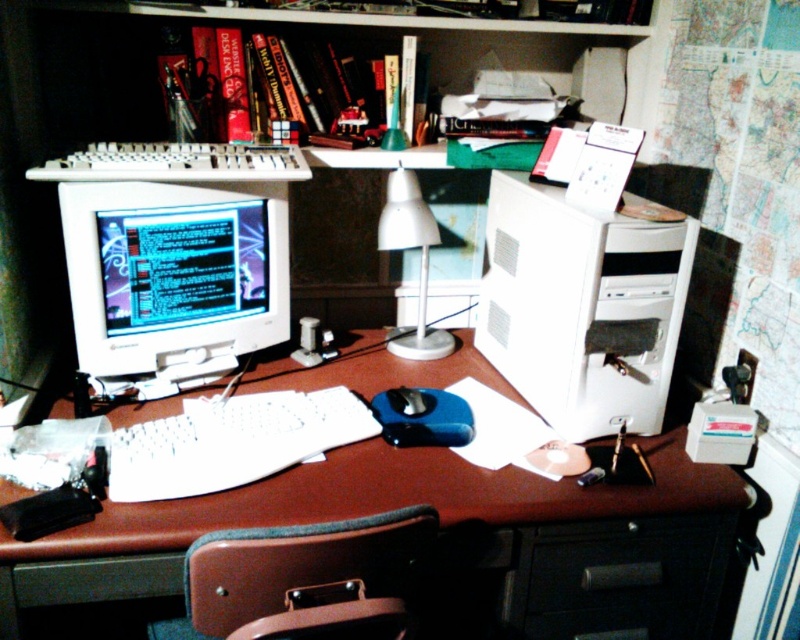
Which is more to the left, matte white monitor at left or brown leather swivel chair at lower center?

matte white monitor at left is more to the left.

From the picture: Can you confirm if matte white monitor at left is thinner than brown leather swivel chair at lower center?

Correct, matte white monitor at left's width is less than brown leather swivel chair at lower center's.

Who is more distant from viewer, (272, 220) or (186, 561)?

Point (272, 220)

At what (x,y) coordinates should I click in order to perform the action: click on matte white monitor at left. Please return your answer as a coordinate pair (x, y). Looking at the image, I should click on (173, 280).

Which is in front, point (388, 196) or point (412, 400)?

Positioned in front is point (412, 400).

Does white plastic lamp at center appear on the right side of black rubber mouse at center?

Yes, white plastic lamp at center is to the right of black rubber mouse at center.

Who is more forward, (444, 348) or (408, 408)?

Point (408, 408)

Locate an element on the screen. The height and width of the screenshot is (640, 800). white plastic lamp at center is located at coordinates (420, 260).

Who is more distant from viewer, (492, 269) or (382, 221)?

Point (492, 269)

Who is higher up, white plastic computer tower at right or white plastic lamp at center?

white plastic lamp at center is above.

Locate an element on the screen. white plastic computer tower at right is located at coordinates (582, 307).